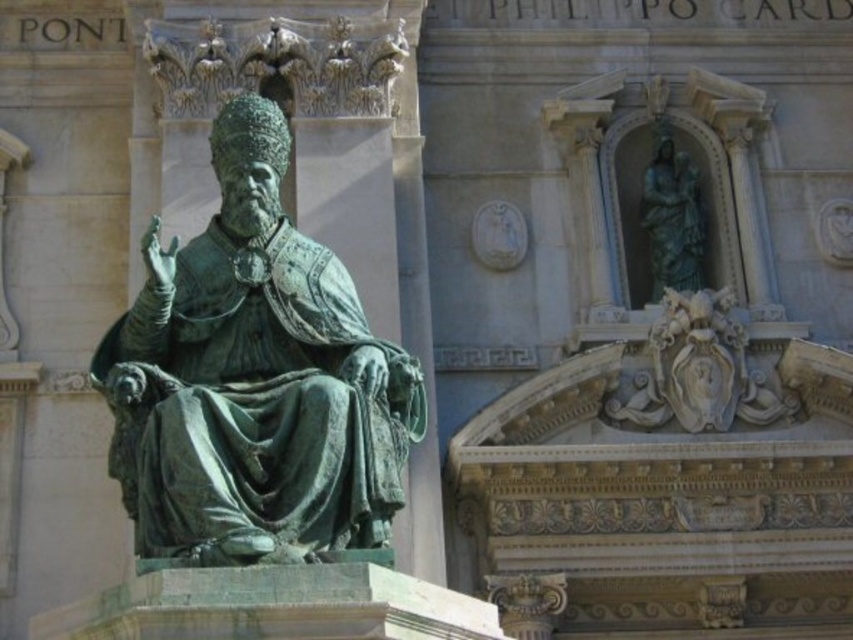
You are standing in front of a church and want to take a photo of the green patina bronze statue at center. If your camera can capture objects up to 100 feet away, will you be able to take a clear photo from your current position?

The green patina bronze statue at center and camera are 104.98 feet apart from each other, which exceeds the camera maximum range of 100 feet. Therefore, you won compare to take a clear photo from your current position.

You are an art conservator assessing the placement of statues in a cathedral. You notice the green patina bronze statue at center and the green patina statue at upper center. Which statue is positioned lower in the scene?

The green patina bronze statue at center is positioned lower than the green patina statue at upper center.

You are an art conservator assessing the space between two statues in a cathedral. You need to determine if a 2.5 meter wide protective barrier can fit between them. The statues are the green patina bronze statue at center and the green patina statue at upper center. Which one is wider and can the barrier fit?

The green patina bronze statue at center is wider than the green patina statue at upper center. Since the barrier is 2.5 meters wide, it depends on the distance between them. However, the description only states the width of the statues, not the space between them. Without knowing the actual distance between the statues, we cannot confirm if the barrier will fit.